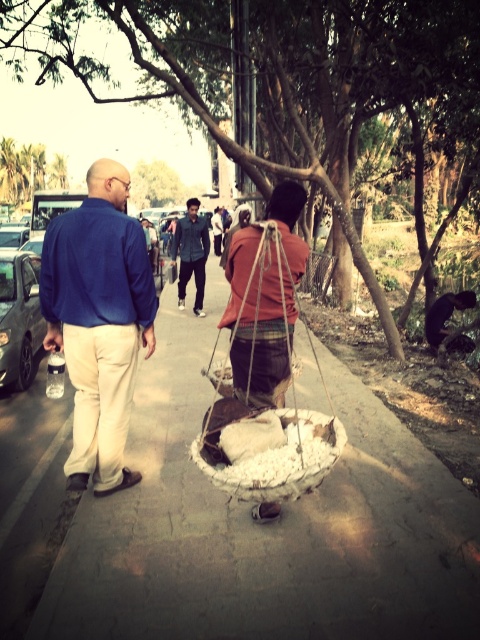
You are standing at the point labeled point (x=232, y=524) in the image. What is the surface you are standing on?

The surface at point (x=232, y=524) is the concrete sidewalk at center.

You are standing at the point labeled as point (x=48, y=634) and want to walk towards the man in the blue shirt and beige pants holding a water bottle. How far will you have to walk to reach him?

The point labeled point (x=48, y=634) is 2.68 meters away from the viewer, so you would need to walk 2.68 meters to reach the man in the blue shirt and beige pants holding a water bottle.